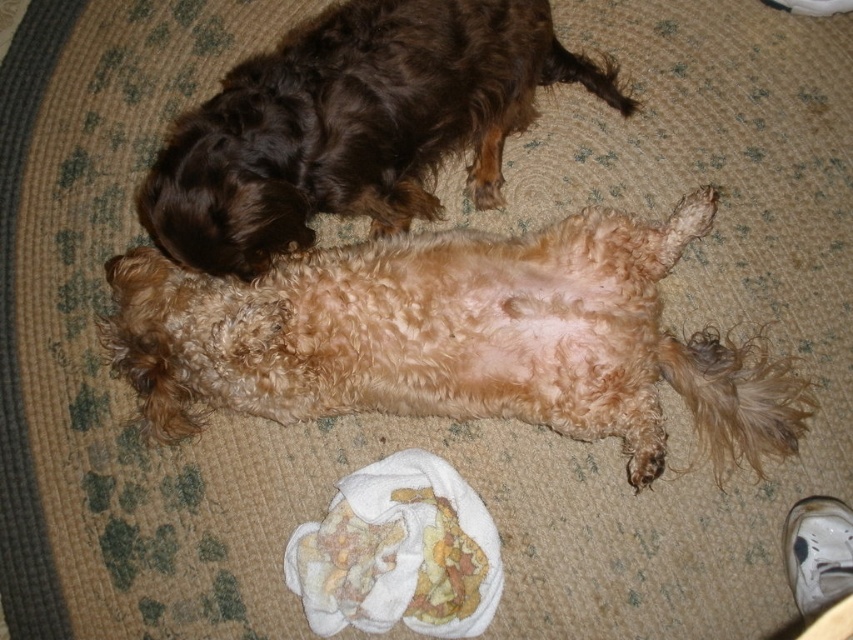
Question: Does fuzzy light brown dog at center have a larger size compared to printed fabric cloth at lower center?

Choices:
 (A) no
 (B) yes

Answer: (B)

Question: Which object appears closest to the camera in this image?

Choices:
 (A) shiny brown fur at upper left
 (B) printed fabric cloth at lower center

Answer: (A)

Question: In this image, where is fuzzy light brown dog at center located relative to printed fabric cloth at lower center?

Choices:
 (A) left
 (B) right

Answer: (B)

Question: Among these objects, which one is farthest from the camera?

Choices:
 (A) shiny brown fur at upper left
 (B) fuzzy light brown dog at center
 (C) printed fabric cloth at lower center

Answer: (C)

Question: Which of the following is the closest to the observer?

Choices:
 (A) fuzzy light brown dog at center
 (B) printed fabric cloth at lower center

Answer: (A)

Question: Is fuzzy light brown dog at center positioned at the back of printed fabric cloth at lower center?

Choices:
 (A) yes
 (B) no

Answer: (B)